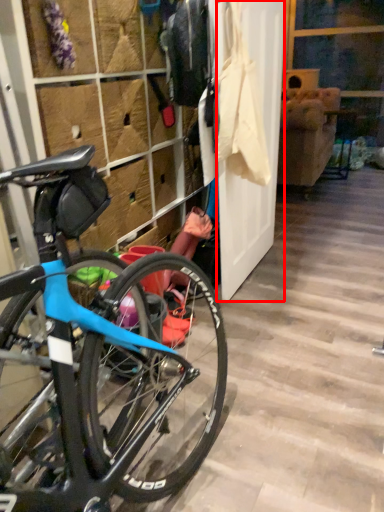
Question: From the image, what is the correct spatial relationship of screen door (annotated by the red box) in relation to closet?

Choices:
 (A) right
 (B) left

Answer: (A)